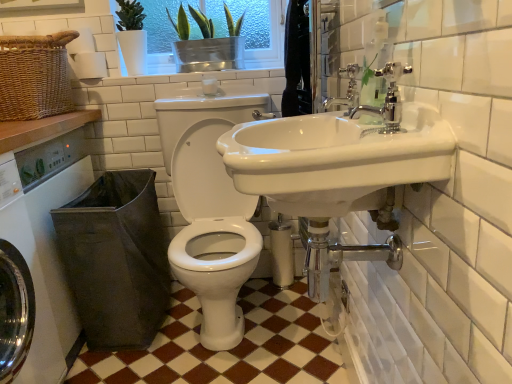
Question: Is white glossy sink at center shorter than chrome metallic faucet at upper right, marked as the 2th tap in a front-to-back arrangement?

Choices:
 (A) no
 (B) yes

Answer: (A)

Question: From a real-world perspective, does white glossy sink at center sit lower than chrome metallic faucet at upper right, marked as the 2th tap in a front-to-back arrangement?

Choices:
 (A) no
 (B) yes

Answer: (B)

Question: Can you confirm if white glossy sink at center is thinner than chrome metallic faucet at upper right, the 1th tap when ordered from back to front?

Choices:
 (A) yes
 (B) no

Answer: (B)

Question: Is white glossy sink at center taller than chrome metallic faucet at upper right, marked as the 2th tap in a front-to-back arrangement?

Choices:
 (A) yes
 (B) no

Answer: (A)

Question: Could you tell me if white glossy sink at center is turned towards chrome metallic faucet at upper right, the 1th tap when ordered from back to front?

Choices:
 (A) yes
 (B) no

Answer: (B)

Question: From the image's perspective, relative to brown/white checkered floor at center, is white tile at upper center above or below?

Choices:
 (A) above
 (B) below

Answer: (A)

Question: Looking at the image, does white tile at upper center seem bigger or smaller compared to brown/white checkered floor at center?

Choices:
 (A) small
 (B) big

Answer: (A)

Question: Is point (199, 81) positioned closer to the camera than point (291, 342)?

Choices:
 (A) farther
 (B) closer

Answer: (A)

Question: From a real-world perspective, is white tile at upper center physically located above or below brown/white checkered floor at center?

Choices:
 (A) below
 (B) above

Answer: (B)

Question: Does point (32, 59) appear closer or farther from the camera than point (353, 109)?

Choices:
 (A) closer
 (B) farther

Answer: (B)

Question: Is woven brown basket at upper left taller or shorter than polished chrome faucet at upper right, the first tap when ordered from front to back?

Choices:
 (A) tall
 (B) short

Answer: (A)

Question: Is woven brown basket at upper left situated inside polished chrome faucet at upper right, which is the second tap in back-to-front order, or outside?

Choices:
 (A) outside
 (B) inside

Answer: (A)

Question: From a real-world perspective, relative to polished chrome faucet at upper right, which is the second tap in back-to-front order, is woven brown basket at upper left vertically above or below?

Choices:
 (A) above
 (B) below

Answer: (A)

Question: In the image, is woven brown basket at upper left positioned in front of or behind brown/white checkered floor at center?

Choices:
 (A) behind
 (B) front

Answer: (B)

Question: In the image, is woven brown basket at upper left on the left side or the right side of brown/white checkered floor at center?

Choices:
 (A) left
 (B) right

Answer: (A)